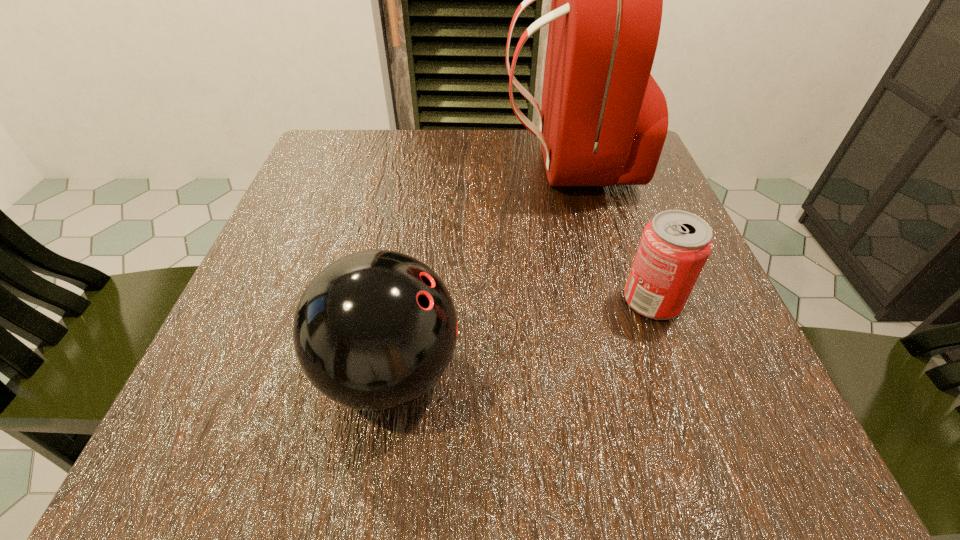
Identify the location of vacant space that satisfies the following two spatial constraints: 1. on the strap side of the soda can; 2. on the right side of the tallest object. (602, 300).

Locate an element on the screen. This screenshot has width=960, height=540. free space that satisfies the following two spatial constraints: 1. on the strap side of the backpack; 2. on the left side of the shortest object is located at coordinates (602, 300).

Where is `vacant space that satisfies the following two spatial constraints: 1. on the strap side of the shortest object; 2. on the left side of the farthest object`? vacant space that satisfies the following two spatial constraints: 1. on the strap side of the shortest object; 2. on the left side of the farthest object is located at coordinates (602, 300).